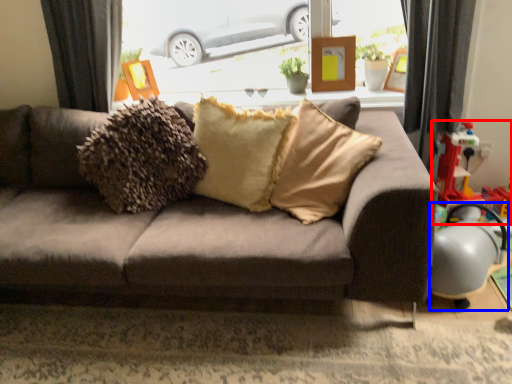
Question: Among these objects, which one is nearest to the camera, toy (highlighted by a red box) or armchair (highlighted by a blue box)?

Choices:
 (A) toy
 (B) armchair

Answer: (B)